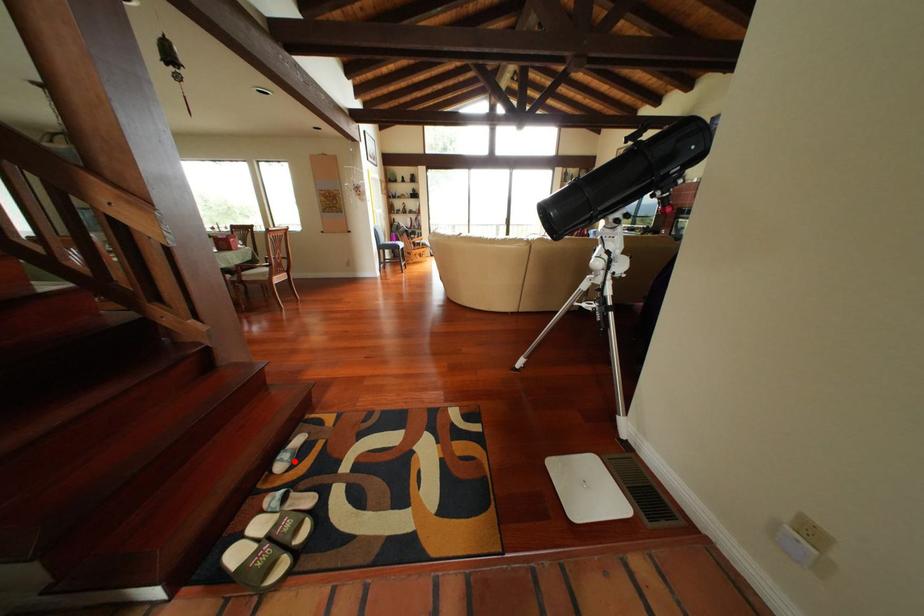
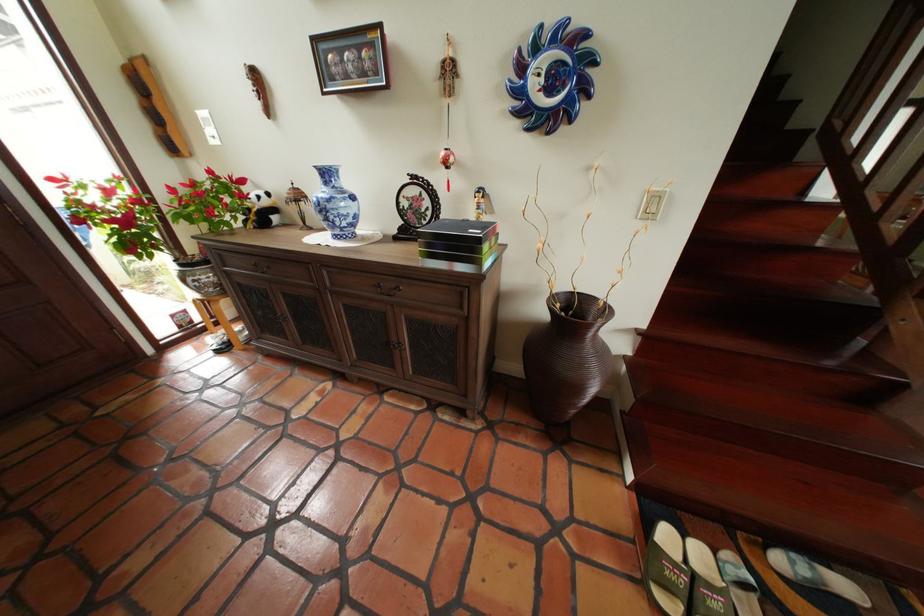
Where in the second image is the point corresponding to the highlighted location from the first image?

(806, 564)